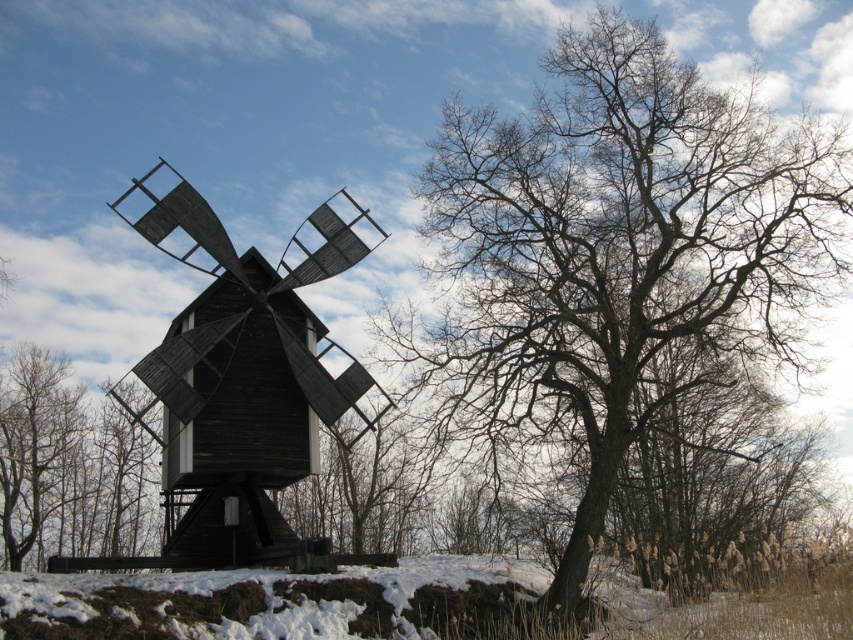
Question: Which point is closer to the camera?

Choices:
 (A) bare wood tree at center
 (B) brown wood tree at left
 (C) dark wood windmill at center

Answer: (C)

Question: Which point appears closest to the camera in this image?

Choices:
 (A) (27, 378)
 (B) (691, 330)
 (C) (165, 221)

Answer: (B)

Question: Is bare wood tree at center to the right of dark wood windmill at center from the viewer's perspective?

Choices:
 (A) no
 (B) yes

Answer: (B)

Question: In this image, where is dark wood windmill at center located relative to brown wood tree at left?

Choices:
 (A) right
 (B) left

Answer: (A)

Question: Considering the real-world distances, which object is closest to the brown wood tree at left?

Choices:
 (A) dark wood windmill at center
 (B) bare wood tree at center

Answer: (A)

Question: Considering the relative positions of bare wood tree at center and brown wood tree at left in the image provided, where is bare wood tree at center located with respect to brown wood tree at left?

Choices:
 (A) below
 (B) above

Answer: (B)